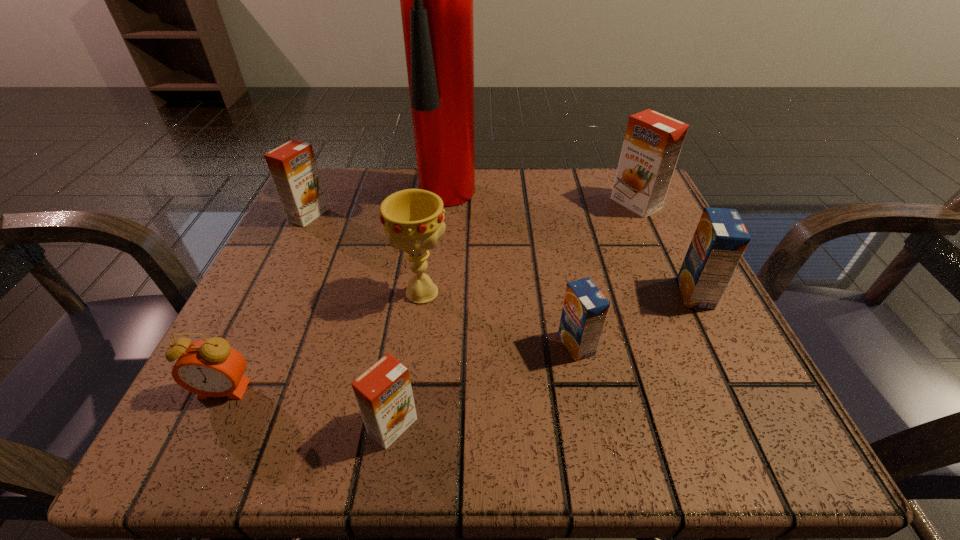
Select which orange orange juice appears as the second closest to the rightmost orange orange juice. Please provide its 2D coordinates. Your answer should be formatted as a tuple, i.e. [(x, y)], where the tuple contains the x and y coordinates of a point satisfying the conditions above.

[(293, 168)]

Find the location of a particular element. This screenshot has height=540, width=960. orange orange juice that stands as the second closest to the biggest orange orange juice is located at coordinates (293, 168).

You are a GUI agent. You are given a task and a screenshot of the screen. Output one action in this format:
    pyautogui.click(x=<x>, y=<y>)
    Task: Click on the vacant point that satisfies the following two spatial constraints: 1. on the back side of the right blue orange_juice; 2. on the right side of the sixth object from left to right
    The height and width of the screenshot is (540, 960).
    Given the screenshot: What is the action you would take?
    pyautogui.click(x=566, y=293)